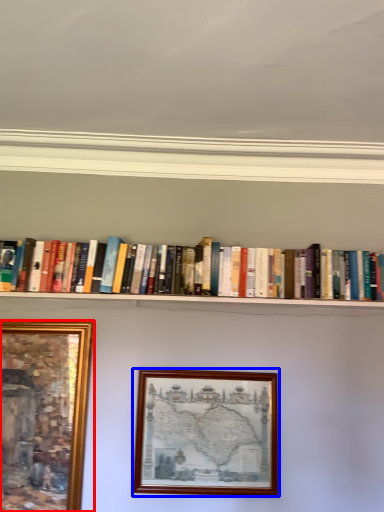
Question: Which of the following is the closest to the observer, picture frame (highlighted by a red box) or picture frame (highlighted by a blue box)?

Choices:
 (A) picture frame
 (B) picture frame

Answer: (A)